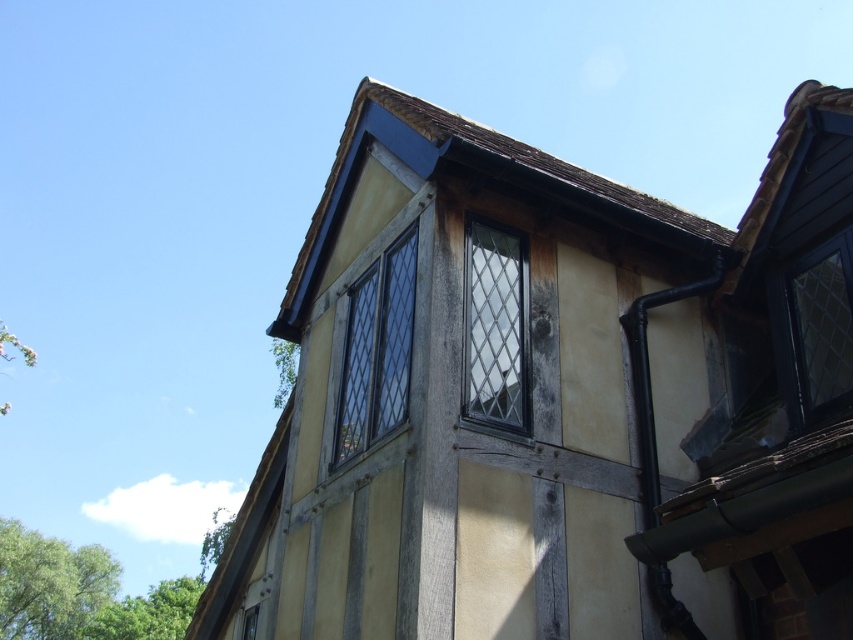
Question: Is clear glass window at upper center positioned in front of matte black window at center?

Choices:
 (A) yes
 (B) no

Answer: (B)

Question: Is clear glass window at upper center to the left of matte black window at center from the viewer's perspective?

Choices:
 (A) yes
 (B) no

Answer: (A)

Question: Which point is farther from the camera taking this photo?

Choices:
 (A) (517, 273)
 (B) (392, 348)

Answer: (B)

Question: Which of the following is the farthest from the observer?

Choices:
 (A) (503, 339)
 (B) (378, 304)

Answer: (B)

Question: Is clear glass window at upper center above matte black window at center?

Choices:
 (A) yes
 (B) no

Answer: (B)

Question: Among these points, which one is nearest to the camera?

Choices:
 (A) (500, 369)
 (B) (399, 289)

Answer: (A)